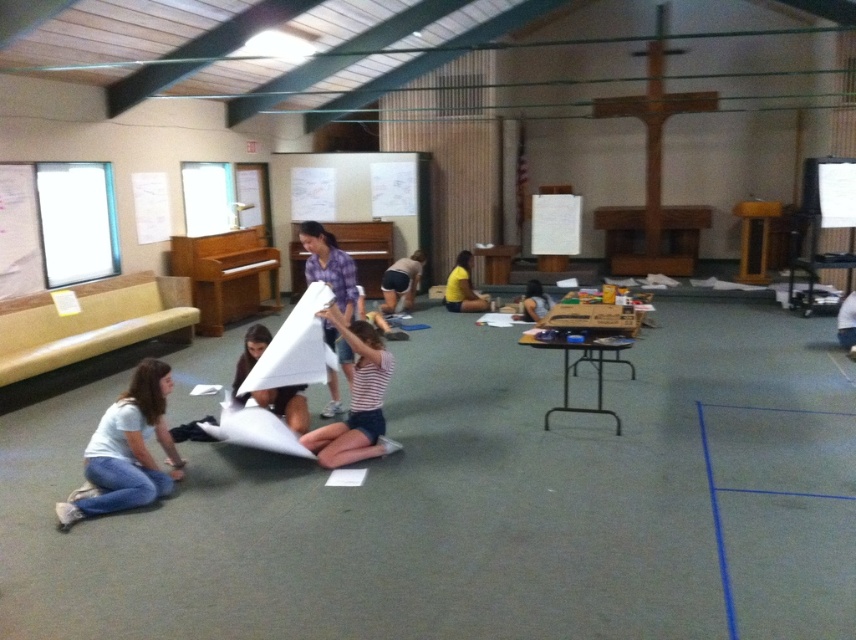
Question: Does striped fabric shirt at center have a larger size compared to white paper at center?

Choices:
 (A) no
 (B) yes

Answer: (B)

Question: Can you confirm if light blue cotton shirt at lower left is thinner than white paper at center?

Choices:
 (A) no
 (B) yes

Answer: (A)

Question: Which point is closer to the camera taking this photo?

Choices:
 (A) (459, 308)
 (B) (526, 310)

Answer: (B)

Question: Which point is farther to the camera?

Choices:
 (A) (343, 288)
 (B) (75, 515)

Answer: (A)

Question: Is the position of matte purple shirt at center less distant than that of matte white paper airplane at center?

Choices:
 (A) yes
 (B) no

Answer: (A)

Question: Which point is farther to the camera?

Choices:
 (A) matte white paper airplane at center
 (B) light blue cotton shirt at lower left

Answer: (A)